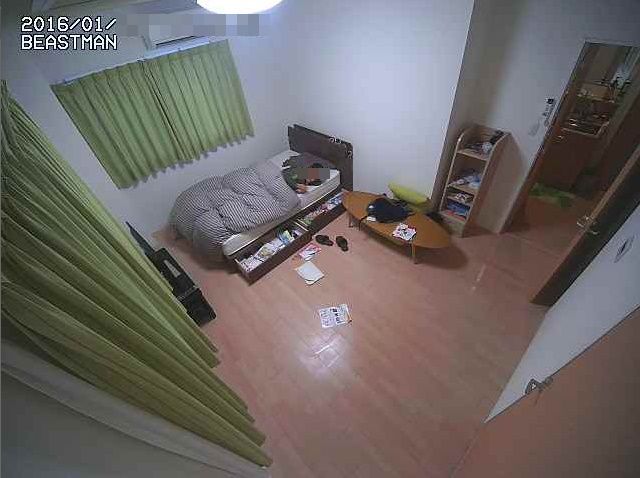
Where is `green curtains`? green curtains is located at coordinates (114, 306).